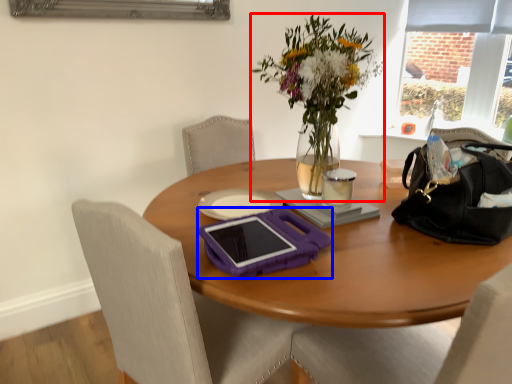
Question: Which object is closer to the camera taking this photo, flower (highlighted by a red box) or tablet computer (highlighted by a blue box)?

Choices:
 (A) flower
 (B) tablet computer

Answer: (B)